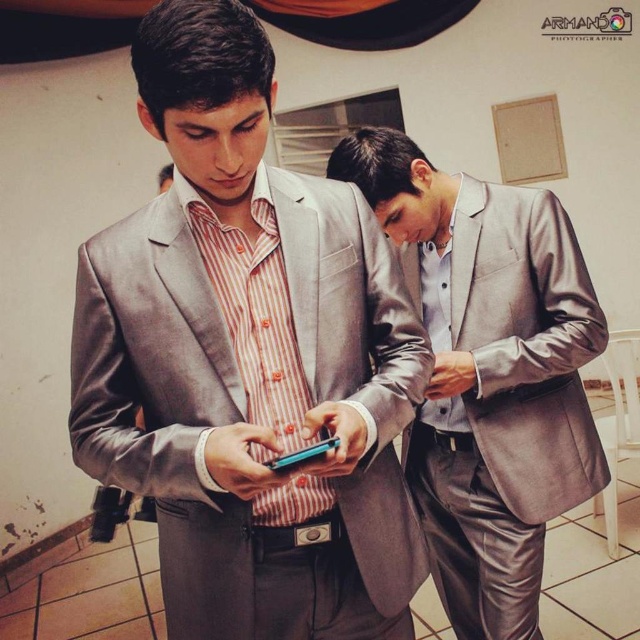
Question: Is matte gray suit at center thinner than satin gray suit at center?

Choices:
 (A) no
 (B) yes

Answer: (B)

Question: Which of these objects is positioned closest to the matte gray suit at center?

Choices:
 (A) satin gray suit at center
 (B) teal glossy smartphone at center

Answer: (B)

Question: Which object appears farthest from the camera in this image?

Choices:
 (A) matte gray suit at center
 (B) satin gray suit at center
 (C) teal glossy smartphone at center

Answer: (B)

Question: Is matte gray suit at center bigger than teal glossy smartphone at center?

Choices:
 (A) no
 (B) yes

Answer: (B)

Question: Which object is closer to the camera taking this photo?

Choices:
 (A) matte gray suit at center
 (B) satin gray suit at center
 (C) teal glossy smartphone at center

Answer: (A)

Question: Does matte gray suit at center have a greater width compared to satin gray suit at center?

Choices:
 (A) no
 (B) yes

Answer: (A)